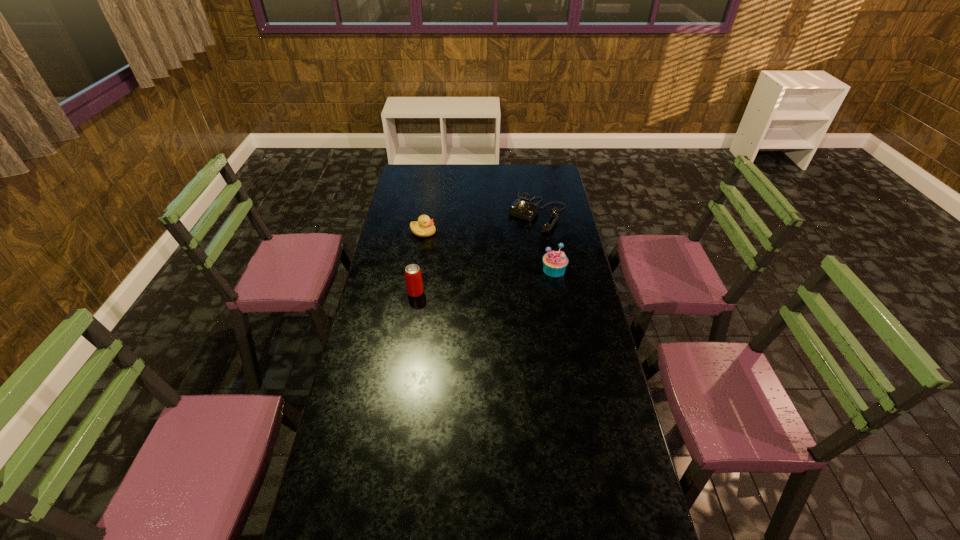
Where is `vacant space that is in between the beer can and the telephone`? Image resolution: width=960 pixels, height=540 pixels. vacant space that is in between the beer can and the telephone is located at coordinates (476, 253).

Identify the location of object that can be found as the closest to the beer can. Image resolution: width=960 pixels, height=540 pixels. (424, 227).

Where is `object that is the second closest one to the third farthest object`? This screenshot has height=540, width=960. object that is the second closest one to the third farthest object is located at coordinates (413, 277).

The height and width of the screenshot is (540, 960). Identify the location of vacant space that satisfies the following two spatial constraints: 1. on the front side of the muffin; 2. on the left side of the telephone. (547, 270).

At what (x,y) coordinates should I click in order to perform the action: click on free space that satisfies the following two spatial constraints: 1. on the back side of the nearest object; 2. on the left side of the telephone. Please return your answer as a coordinate pair (x, y). Image resolution: width=960 pixels, height=540 pixels. Looking at the image, I should click on (427, 213).